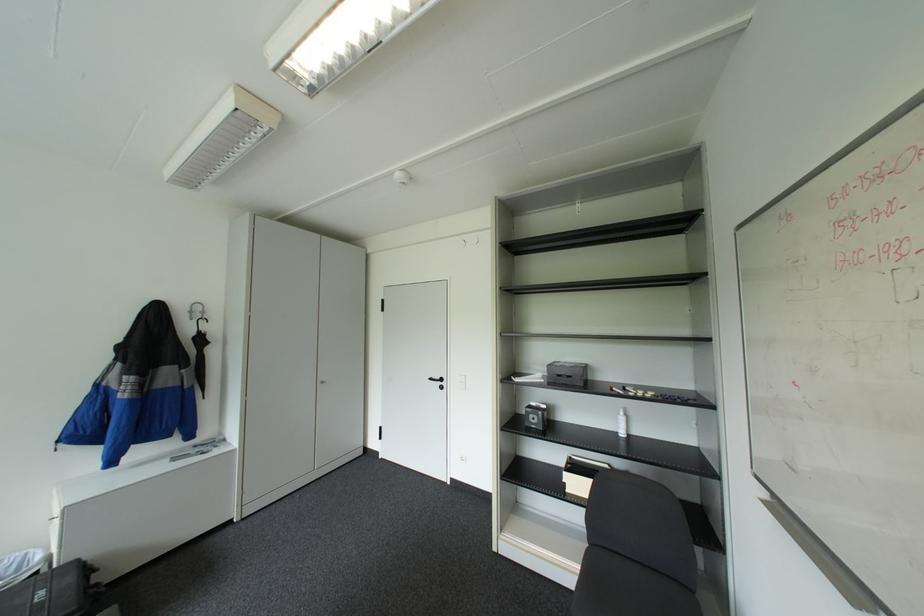
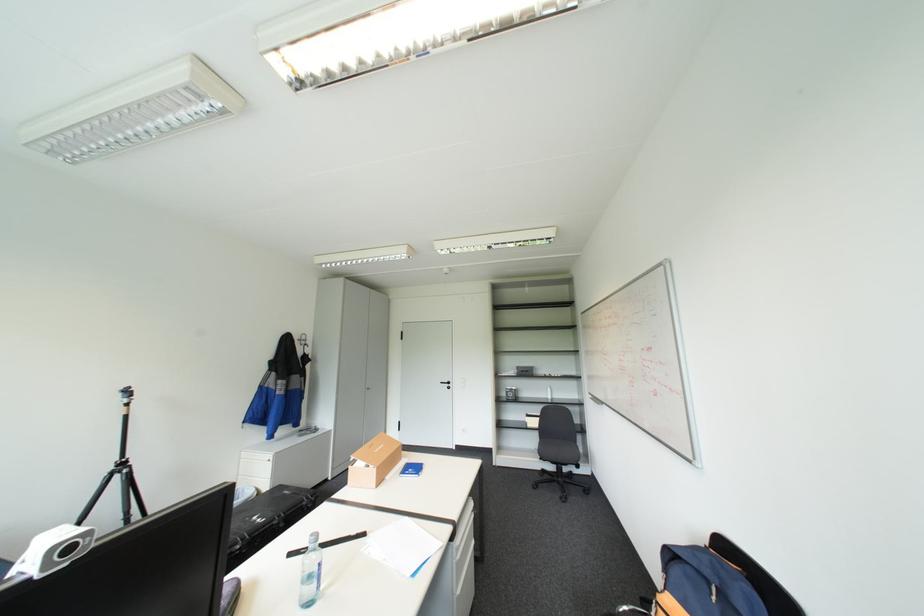
Locate, in the second image, the point that corresponds to (66,520) in the first image.

(278, 461)